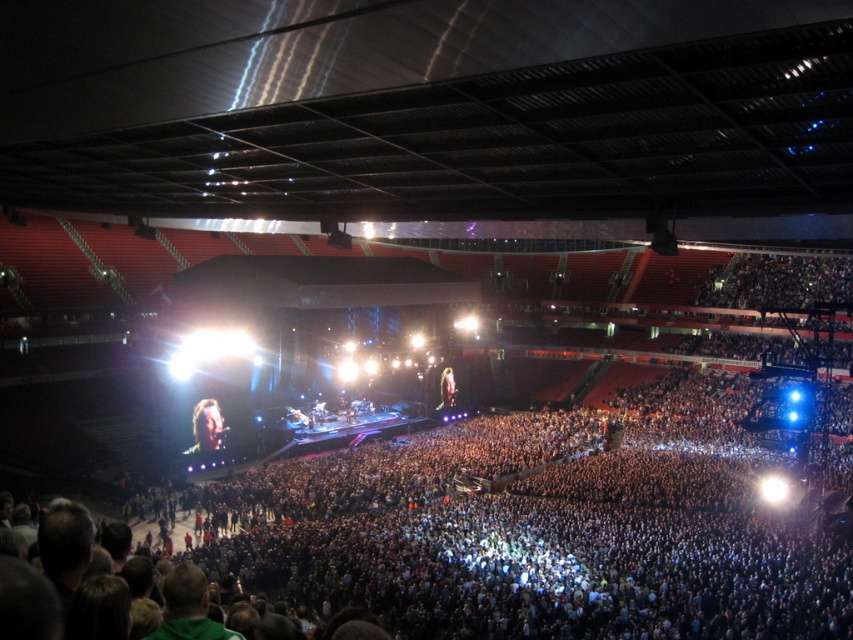
Is shiny brown hair at center to the left of shiny gold hair at center from the viewer's perspective?

Indeed, shiny brown hair at center is positioned on the left side of shiny gold hair at center.

Based on the photo, is shiny brown hair at center positioned in front of shiny gold hair at center?

Yes.

The height and width of the screenshot is (640, 853). What are the coordinates of `shiny brown hair at center` in the screenshot? It's located at (207, 426).